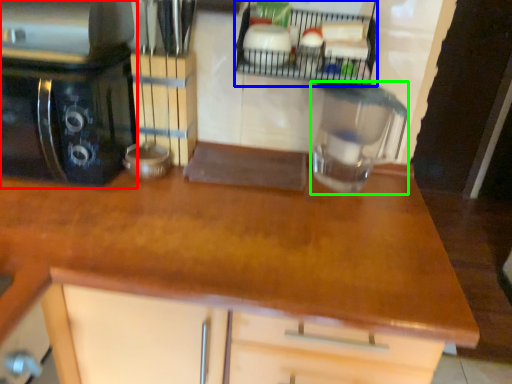
Question: Based on their relative distances, which object is nearer to home appliance (highlighted by a red box)? Choose from shelf (highlighted by a blue box) and kitchen appliance (highlighted by a green box).

Choices:
 (A) shelf
 (B) kitchen appliance

Answer: (A)